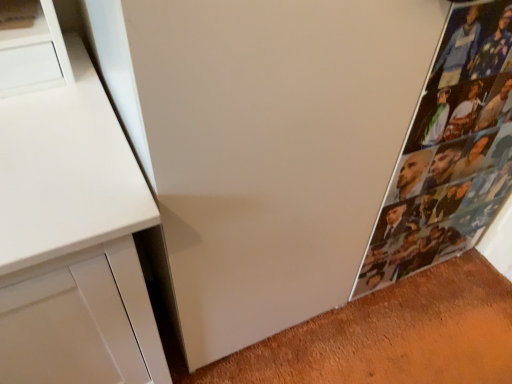
Where is `printed paper collage at right`? printed paper collage at right is located at coordinates (450, 150).

What do you see at coordinates (450, 150) in the screenshot? The height and width of the screenshot is (384, 512). I see `printed paper collage at right` at bounding box center [450, 150].

Identify the location of printed paper collage at right. (450, 150).